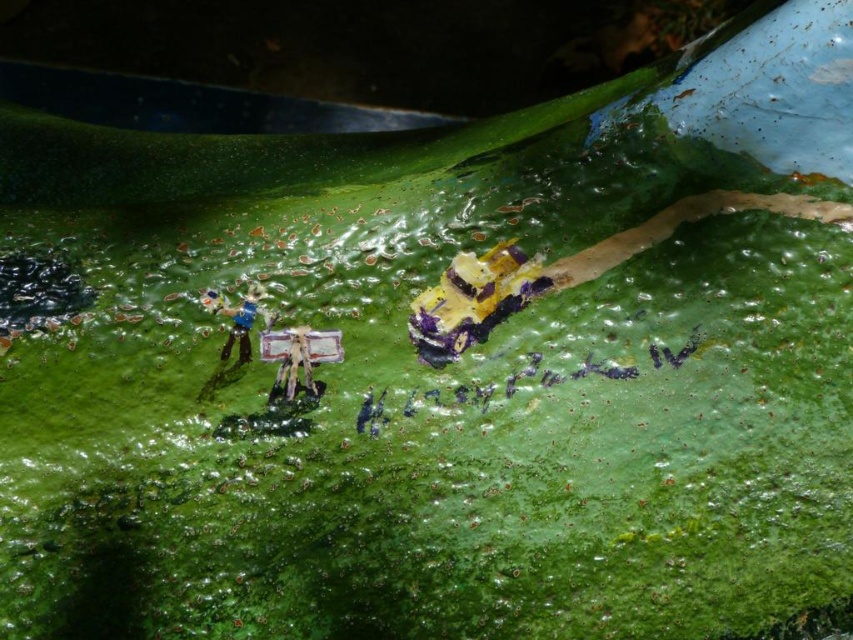
Does yellow and purple plastic toy at center have a greater height compared to metallic silver figure at center?

Correct, yellow and purple plastic toy at center is much taller as metallic silver figure at center.

Measure the distance between point [498,308] and camera.

Point [498,308] and camera are 71.35 centimeters apart.

What are the coordinates of `yellow and purple plastic toy at center` in the screenshot? It's located at (473, 300).

Does metallic silver figure at center appear under matte plastic figure at upper left?

Yes, metallic silver figure at center is below matte plastic figure at upper left.

Is metallic silver figure at center to the left of matte plastic figure at upper left from the viewer's perspective?

In fact, metallic silver figure at center is to the right of matte plastic figure at upper left.

Which is behind, point (292, 348) or point (252, 310)?

The point (252, 310) is more distant.

Find the location of a particular element. The image size is (853, 640). metallic silver figure at center is located at coordinates (294, 364).

Is the position of yellow and purple plastic toy at center more distant than that of matte plastic figure at upper left?

No, yellow and purple plastic toy at center is closer to the viewer.

Is point (437, 323) farther from viewer compared to point (239, 337)?

Yes, it is.

Between point (430, 321) and point (247, 307), which one is positioned behind?

The point (430, 321) is more distant.

You are a GUI agent. You are given a task and a screenshot of the screen. Output one action in this format:
    pyautogui.click(x=<x>, y=<y>)
    Task: Click on the yellow and purple plastic toy at center
    
    Given the screenshot: What is the action you would take?
    pyautogui.click(x=473, y=300)